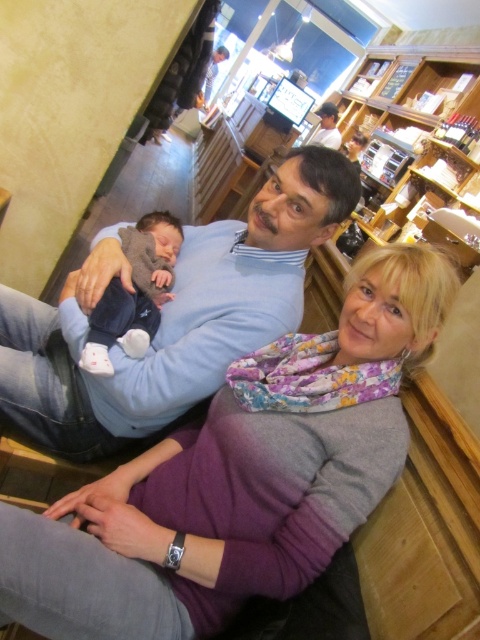
Question: Does purple fabric scarf at center lie in front of matte blue sweater at center?

Choices:
 (A) no
 (B) yes

Answer: (B)

Question: Does purple fabric scarf at center appear on the left side of matte blue sweater at center?

Choices:
 (A) yes
 (B) no

Answer: (B)

Question: Which object appears closest to the camera in this image?

Choices:
 (A) matte blue sweater at center
 (B) soft blue fabric baby at center
 (C) purple fabric scarf at center

Answer: (C)

Question: Can you confirm if purple fabric scarf at center is positioned to the right of matte blue sweater at center?

Choices:
 (A) no
 (B) yes

Answer: (B)

Question: Based on their relative distances, which object is nearer to the purple fabric scarf at center?

Choices:
 (A) matte blue sweater at center
 (B) soft blue fabric baby at center

Answer: (A)

Question: Which of the following is the farthest from the observer?

Choices:
 (A) (36, 401)
 (B) (119, 317)

Answer: (A)